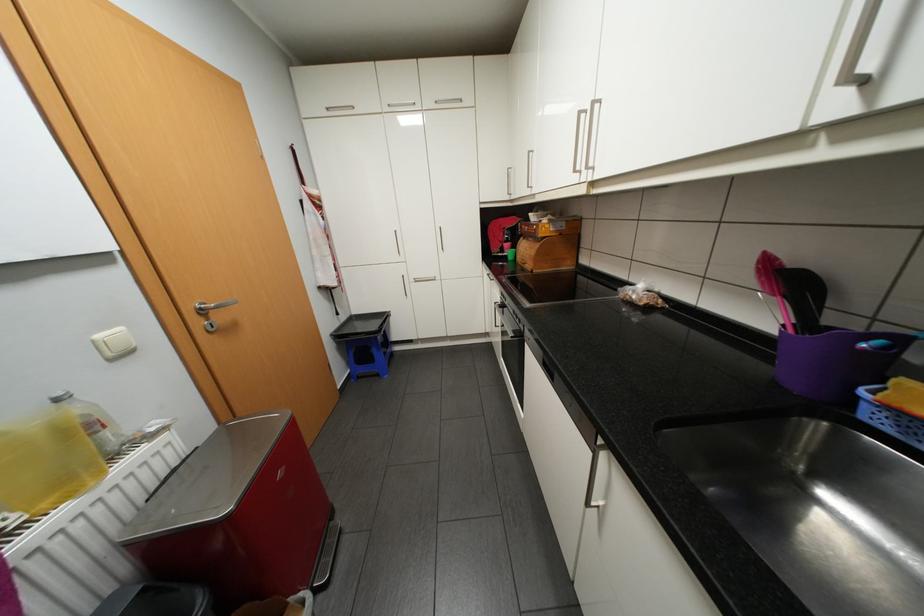
The height and width of the screenshot is (616, 924). What do you see at coordinates (325, 556) in the screenshot?
I see `a trash can pedal` at bounding box center [325, 556].